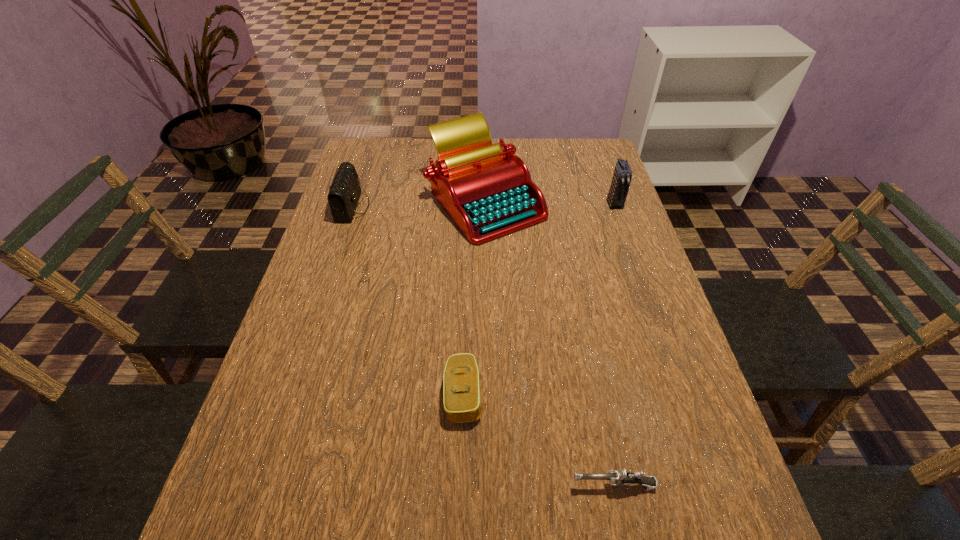
Identify the location of free space at the left edge. The height and width of the screenshot is (540, 960). (320, 394).

In the image, there is a desktop. At what (x,y) coordinates should I click in order to perform the action: click on free space at the right edge. Please return your answer as a coordinate pair (x, y). Looking at the image, I should click on (677, 445).

In the image, there is a desktop. In order to click on free space at the far left corner in this screenshot , I will do `click(397, 154)`.

You are a GUI agent. You are given a task and a screenshot of the screen. Output one action in this format:
    pyautogui.click(x=<x>, y=<y>)
    Task: Click on the vacant region at the far right corner of the desktop
    This screenshot has width=960, height=540.
    Given the screenshot: What is the action you would take?
    pyautogui.click(x=585, y=139)

Image resolution: width=960 pixels, height=540 pixels. I want to click on free spot between the gun and the leftmost object, so click(x=483, y=346).

I want to click on vacant region between the third shortest object and the tallest object, so click(x=419, y=204).

I want to click on free space between the second clutch bag from left to right and the typewriter, so click(474, 298).

Locate an element on the screen. free spot between the shortest clutch bag and the tallest clutch bag is located at coordinates (539, 299).

The width and height of the screenshot is (960, 540). In order to click on vacant space that is in between the typewriter and the nearest object in this screenshot , I will do `click(549, 343)`.

Where is `vacant space that is in between the typewriter and the leftmost clutch bag`? vacant space that is in between the typewriter and the leftmost clutch bag is located at coordinates (419, 204).